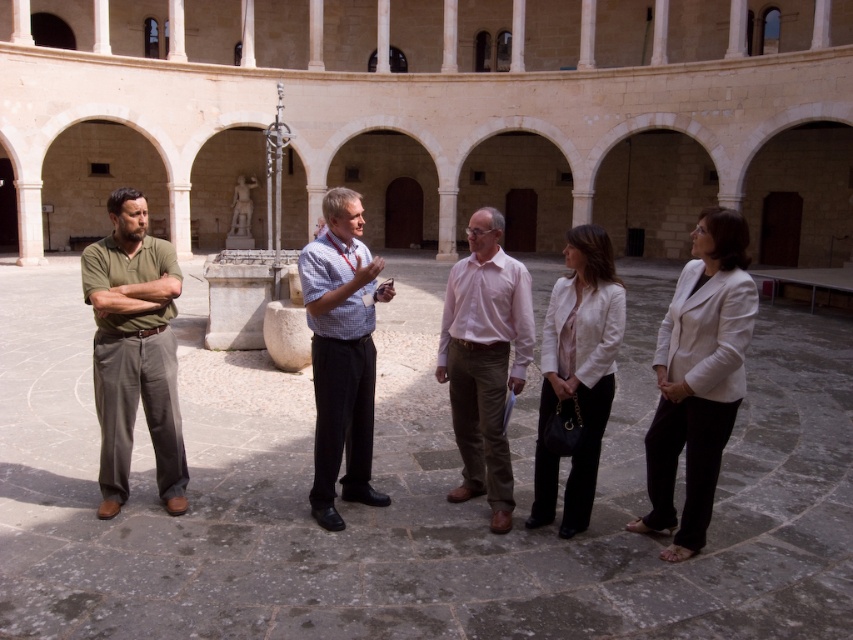
Does pink cotton shirt at center have a smaller size compared to checkered shirt at center?

Indeed, pink cotton shirt at center has a smaller size compared to checkered shirt at center.

Can you confirm if pink cotton shirt at center is positioned to the right of checkered shirt at center?

Yes, pink cotton shirt at center is to the right of checkered shirt at center.

Which is behind, point (456, 433) or point (335, 262)?

Positioned behind is point (456, 433).

You are a GUI agent. You are given a task and a screenshot of the screen. Output one action in this format:
    pyautogui.click(x=<x>, y=<y>)
    Task: Click on the pink cotton shirt at center
    The height and width of the screenshot is (640, 853).
    Given the screenshot: What is the action you would take?
    pyautogui.click(x=485, y=358)

Which is below, matte green shirt at left or checkered shirt at center?

checkered shirt at center

Is matte green shirt at left further to the viewer compared to checkered shirt at center?

That is False.

Describe the element at coordinates (134, 349) in the screenshot. The height and width of the screenshot is (640, 853). I see `matte green shirt at left` at that location.

The height and width of the screenshot is (640, 853). I want to click on matte green shirt at left, so click(134, 349).

Does point (132, 240) come farther from viewer compared to point (479, 481)?

No, it is not.

Between matte green shirt at left and pink cotton shirt at center, which one appears on the left side from the viewer's perspective?

matte green shirt at left is more to the left.

Does point (173, 486) come farther from viewer compared to point (482, 221)?

That is True.

The image size is (853, 640). What are the coordinates of `matte green shirt at left` in the screenshot? It's located at (134, 349).